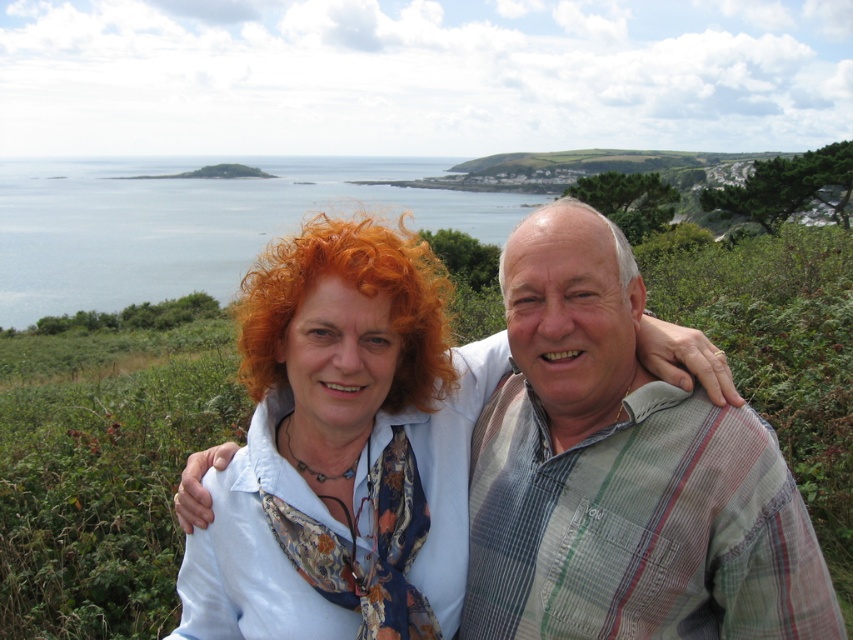
Question: Among these objects, which one is farthest from the camera?

Choices:
 (A) curly orange hair at center
 (B) striped cotton shirt at center

Answer: (A)

Question: Can you confirm if striped cotton shirt at center is positioned to the right of blue water at upper left?

Choices:
 (A) yes
 (B) no

Answer: (A)

Question: Estimate the real-world distances between objects in this image. Which object is farther from the blue water at upper left?

Choices:
 (A) curly orange hair at center
 (B) gray matte hair at center
 (C) striped cotton shirt at center

Answer: (A)

Question: Is striped cotton shirt at center wider than gray matte hair at center?

Choices:
 (A) yes
 (B) no

Answer: (B)

Question: Which point is farther to the camera?

Choices:
 (A) blue water at upper left
 (B) striped cotton shirt at center
 (C) gray matte hair at center

Answer: (A)

Question: Does striped cotton shirt at center have a larger size compared to gray matte hair at center?

Choices:
 (A) no
 (B) yes

Answer: (A)